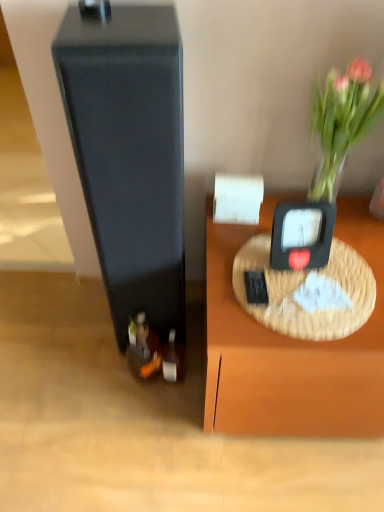
What are the coordinates of `free space to the left of shiny dark glass wine bottle at lower left, which is the 2th wine bottle from right to left` in the screenshot? It's located at (101, 390).